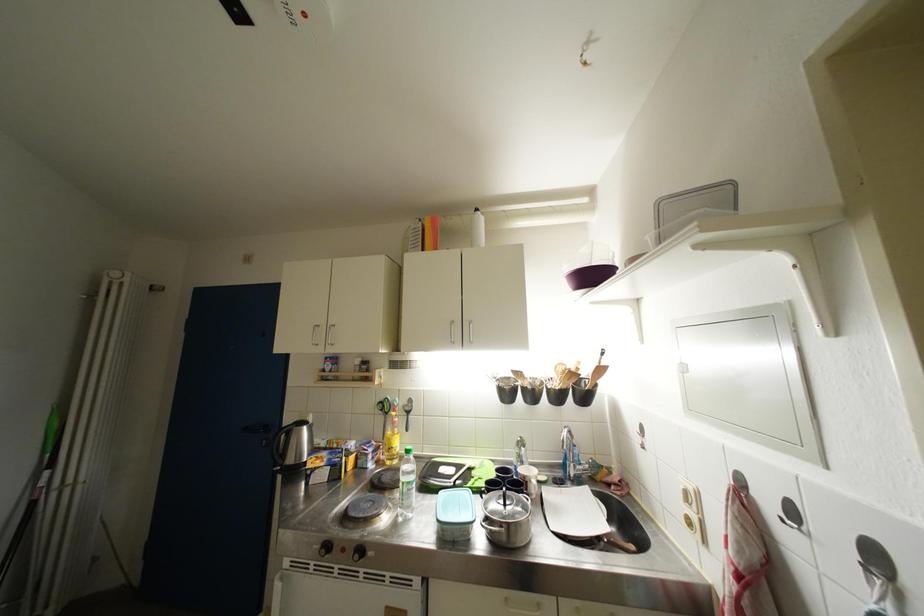
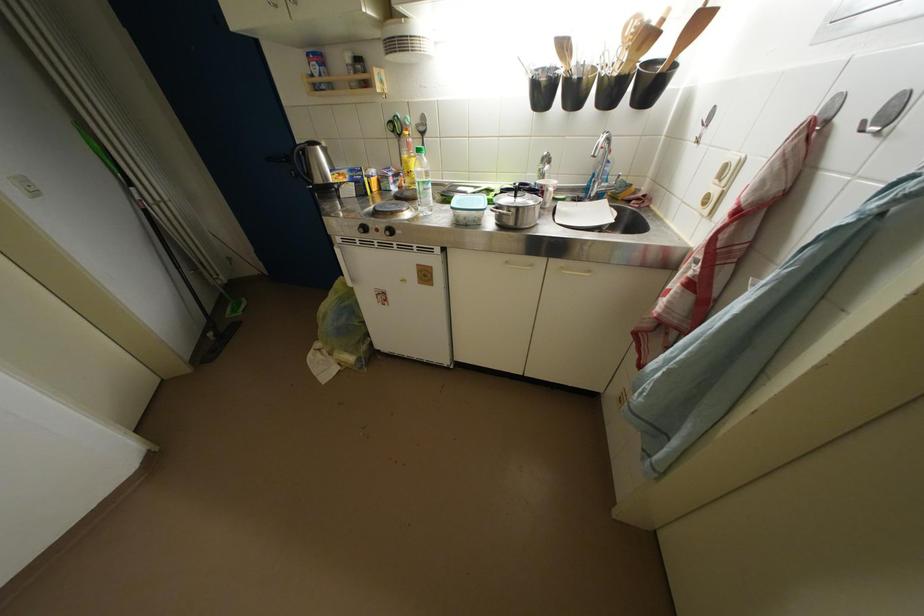
Locate, in the second image, the point that corresponds to (x=477, y=472) in the first image.

(495, 193)